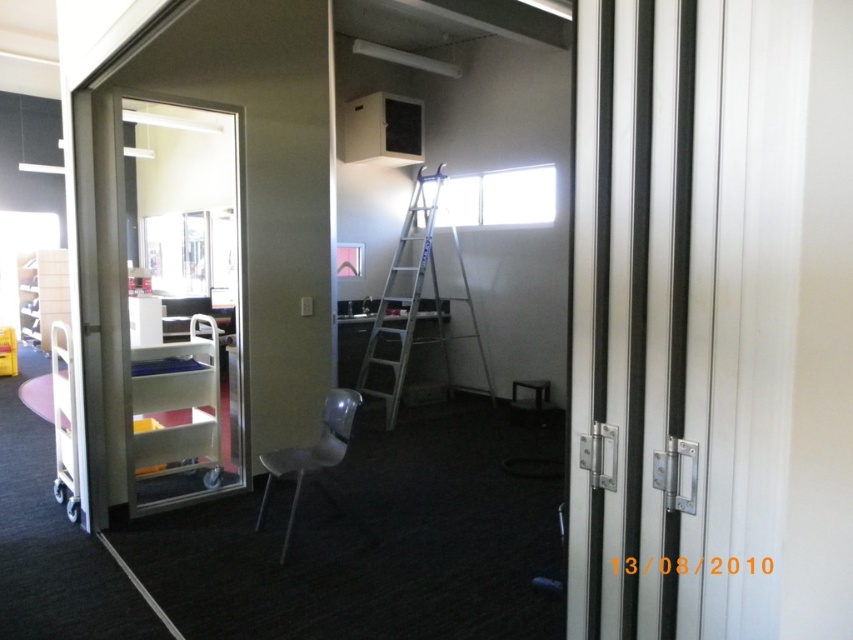
Looking at this image, you are standing in the doorway and want to reach a tool located at point [294,490]. There is an obstacle at point [184,460]. Will you need to go around the obstacle to reach the tool?

Yes, you will need to go around the obstacle at point [184,460] because it is closer to you than the tool at point [294,490], so it blocks the direct path.

Consider the image. You are a painter who needs to reach a high ceiling in the room. You see the silver metallic ladder at center and the matte gray chair at center. Which object should you use to safely reach the ceiling?

The silver metallic ladder at center has a greater height compared to the matte gray chair at center, so you should use the silver metallic ladder at center to safely reach the ceiling.